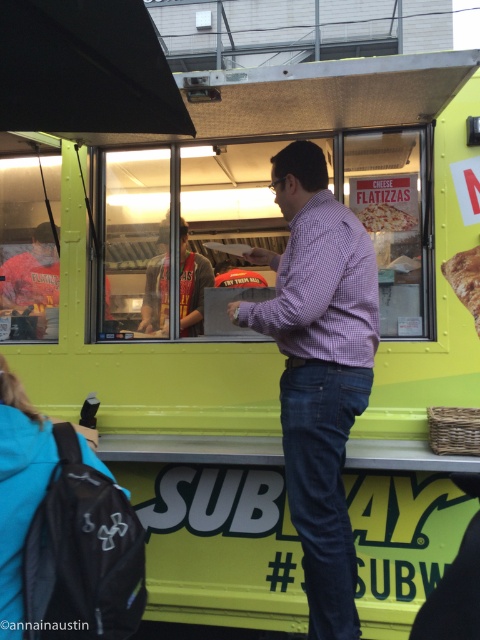
Which is above, purple checkered shirt at center or golden brown bread at right?

golden brown bread at right is higher up.

Can you confirm if purple checkered shirt at center is wider than golden brown bread at right?

Correct, the width of purple checkered shirt at center exceeds that of golden brown bread at right.

Who is more forward, (338, 481) or (464, 276)?

Point (338, 481)

Image resolution: width=480 pixels, height=640 pixels. I want to click on purple checkered shirt at center, so click(319, 369).

Can you confirm if black backpack at lower left is wider than cheese pizza at center?

Correct, the width of black backpack at lower left exceeds that of cheese pizza at center.

Describe the element at coordinates (19, 490) in the screenshot. I see `black backpack at lower left` at that location.

The width and height of the screenshot is (480, 640). In order to click on black backpack at lower left in this screenshot , I will do `click(19, 490)`.

Looking at this image, can you confirm if black backpack at lower left is positioned below golden brown bread at right?

Indeed, black backpack at lower left is positioned under golden brown bread at right.

Which is below, black backpack at lower left or golden brown bread at right?

black backpack at lower left

This screenshot has width=480, height=640. Identify the location of black backpack at lower left. (19, 490).

You are a GUI agent. You are given a task and a screenshot of the screen. Output one action in this format:
    pyautogui.click(x=<x>, y=<y>)
    Task: Click on the black backpack at lower left
    The width and height of the screenshot is (480, 640).
    Given the screenshot: What is the action you would take?
    pyautogui.click(x=19, y=490)